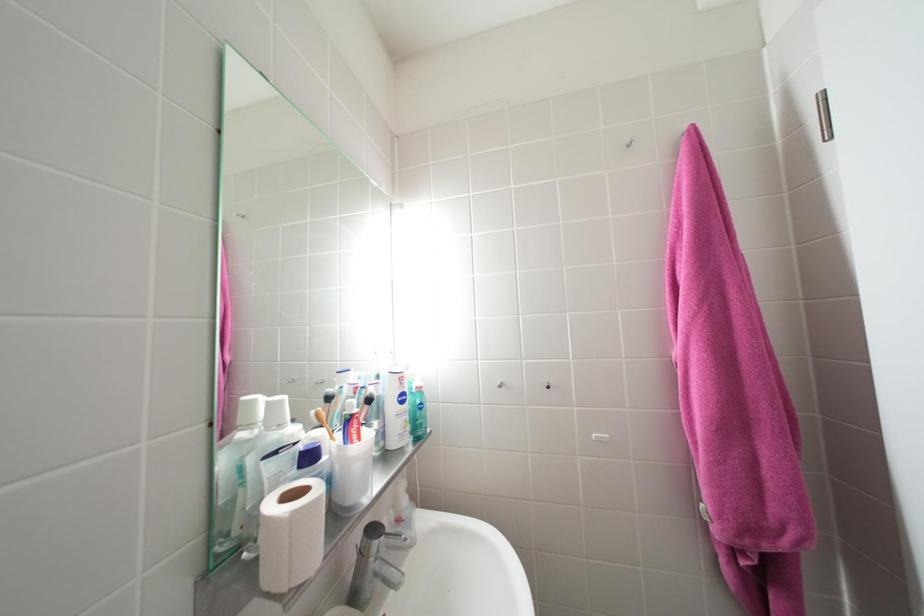
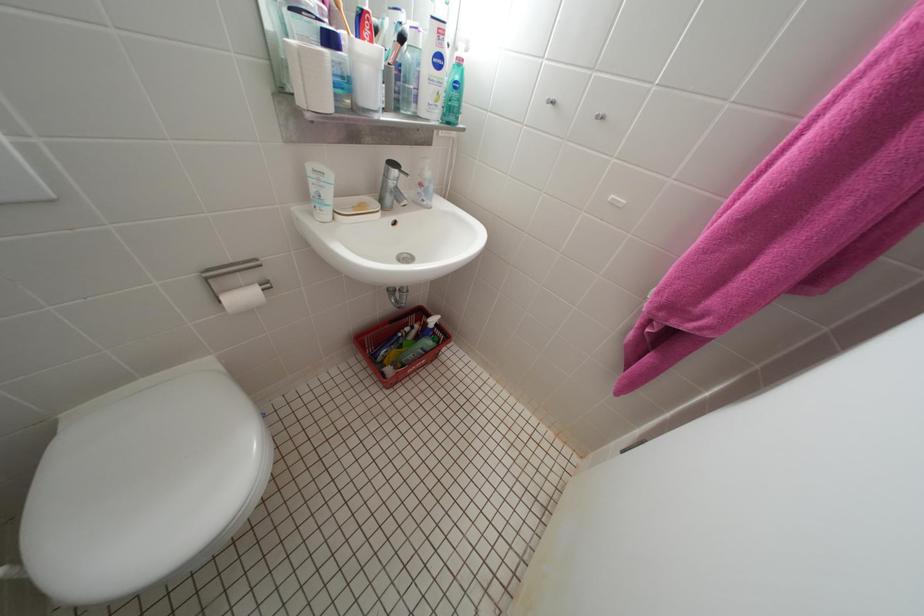
First-person continuous shooting, in which direction is the camera rotating?

The rotation direction of the camera is left-down.